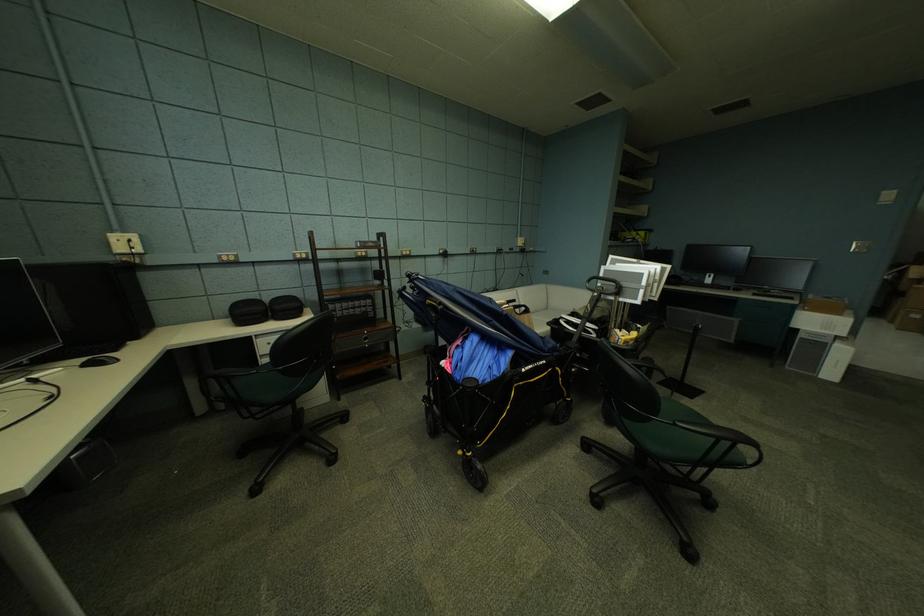
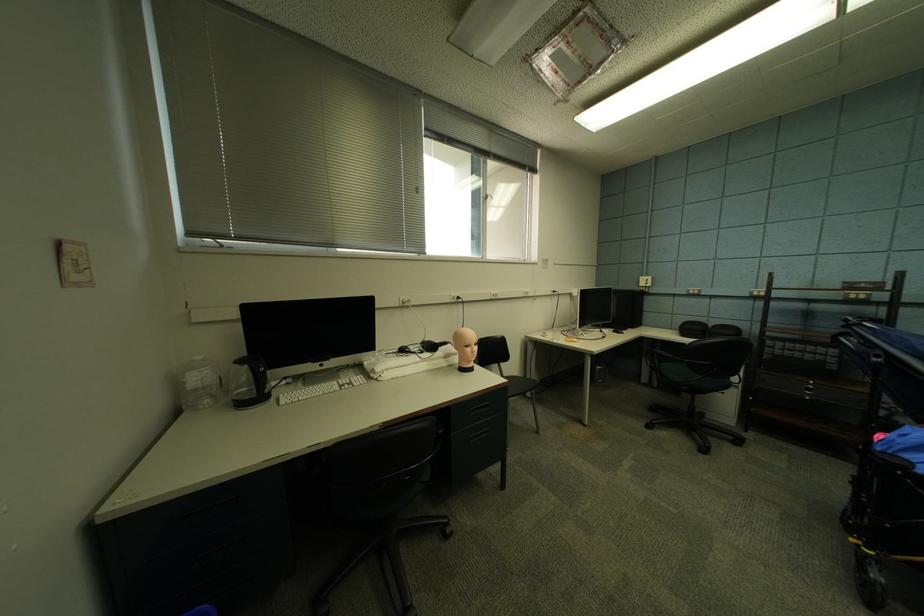
Where in the second image is the point corresponding to point 122,241 from the first image?

(650, 282)